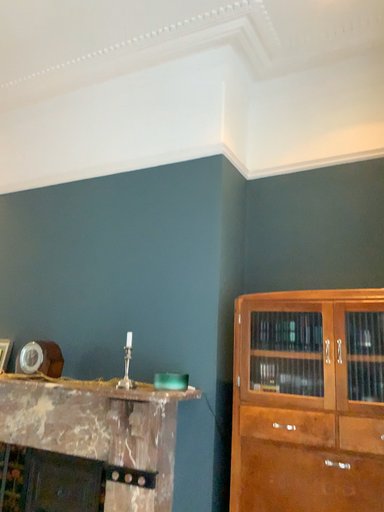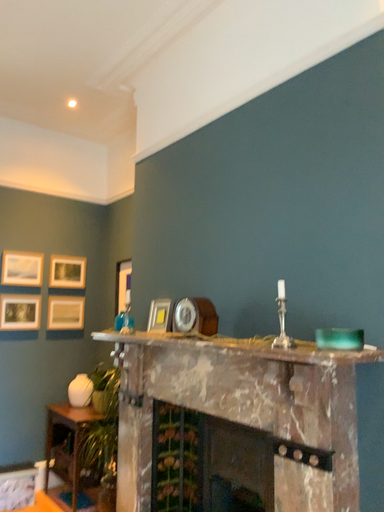
Question: How did the camera likely rotate when shooting the video?

Choices:
 (A) rotated downward
 (B) rotated upward

Answer: (A)